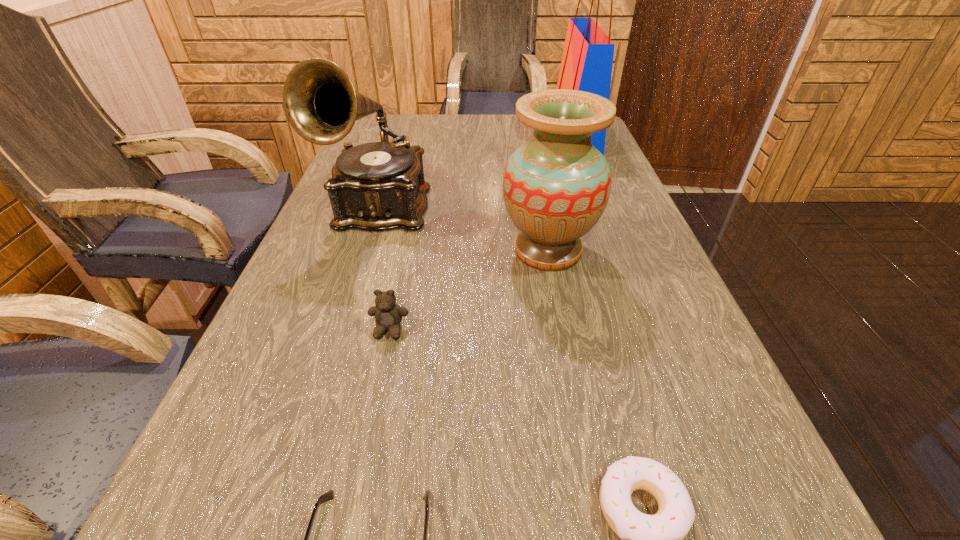
In order to click on shopping bag in this screenshot , I will do `click(587, 60)`.

Locate an element on the screen. the farthest object is located at coordinates (587, 60).

Locate an element on the screen. This screenshot has height=540, width=960. the second tallest object is located at coordinates (374, 186).

Find the location of `the third tallest object`. the third tallest object is located at coordinates (556, 186).

Identify the location of the fourth tallest object. (388, 315).

Locate an element on the screen. The height and width of the screenshot is (540, 960). the third nearest object is located at coordinates (388, 315).

Locate an element on the screen. The width and height of the screenshot is (960, 540). free spot located on the handle side of the tallest object is located at coordinates (493, 136).

You are a GUI agent. You are given a task and a screenshot of the screen. Output one action in this format:
    pyautogui.click(x=<x>, y=<y>)
    Task: Click on the free spot located 0.340m on the handle side of the tallest object
    
    Given the screenshot: What is the action you would take?
    pyautogui.click(x=445, y=136)

Where is `vacant space located 0.070m on the handle side of the tallest object`? vacant space located 0.070m on the handle side of the tallest object is located at coordinates (533, 136).

You are a GUI agent. You are given a task and a screenshot of the screen. Output one action in this format:
    pyautogui.click(x=<x>, y=<y>)
    Task: Click on the free space located 0.080m on the horn of the phonograph record
    This screenshot has height=540, width=960.
    Given the screenshot: What is the action you would take?
    (360, 269)